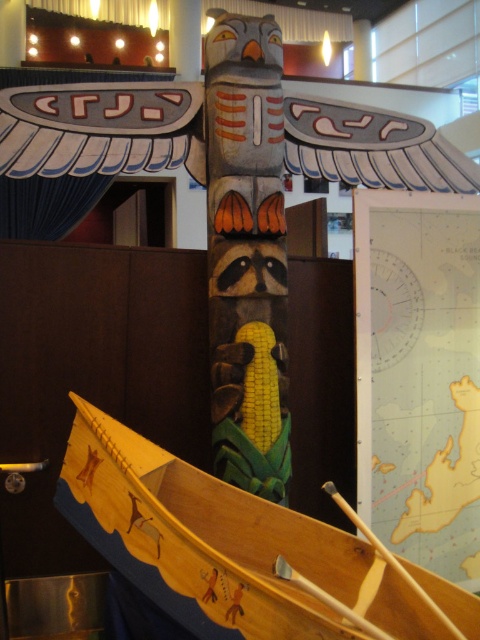
Between wooden canoe at center and wooden at lower center, which one has more height?

wooden canoe at center is taller.

Does point (84, 410) come farther from viewer compared to point (342, 506)?

Yes, point (84, 410) is behind point (342, 506).

Find the location of a particular element. wooden canoe at center is located at coordinates (223, 545).